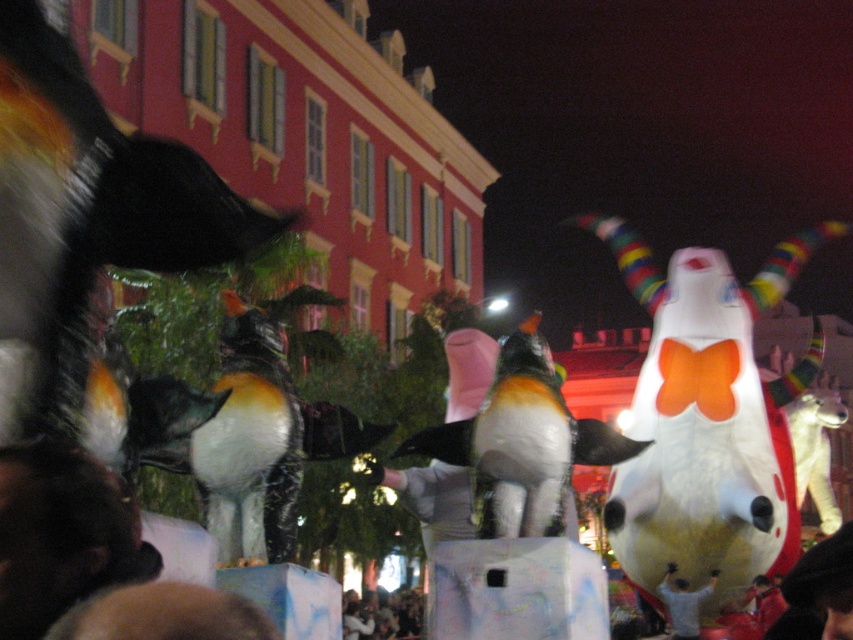
You are a photographer at the parade and want to capture a photo that includes both the white glossy horned bull at center and the smooth white shirt at center. Based on their positions, which object should you place on the right side of your camera frame to ensure both are in the shot?

The white glossy horned bull at center is positioned on the right side of smooth white shirt at center. To include both in the shot, you should place the white glossy horned bull at center on the right side of your camera frame.

You are a photographer at the parade and want to capture a photo where the orange and white plush penguin at center and smooth white shirt at center are both visible. Based on their positions, which object should you focus on to ensure both are in frame?

The orange and white plush penguin at center is located above the smooth white shirt at center. To capture both in the frame, focus on the area where the penguin is positioned above the shirt, ensuring the camera includes both the upper and lower parts of the scene.